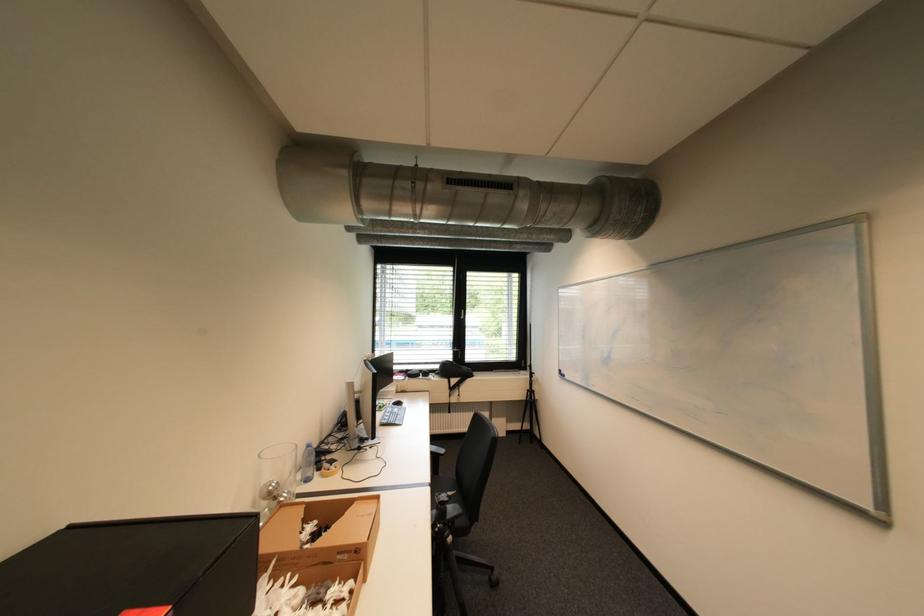
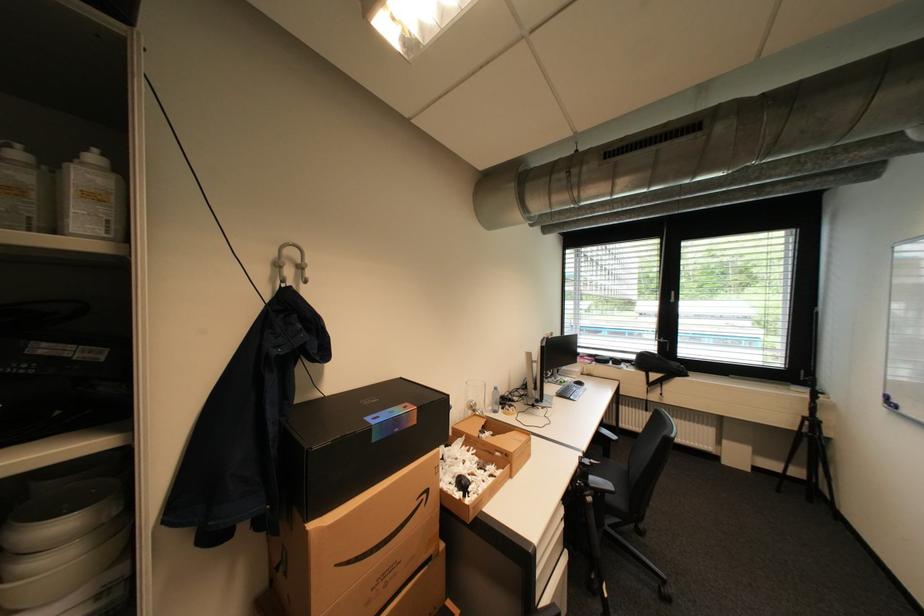
Locate, in the second image, the point that corresponds to [464,349] in the first image.

(670, 339)